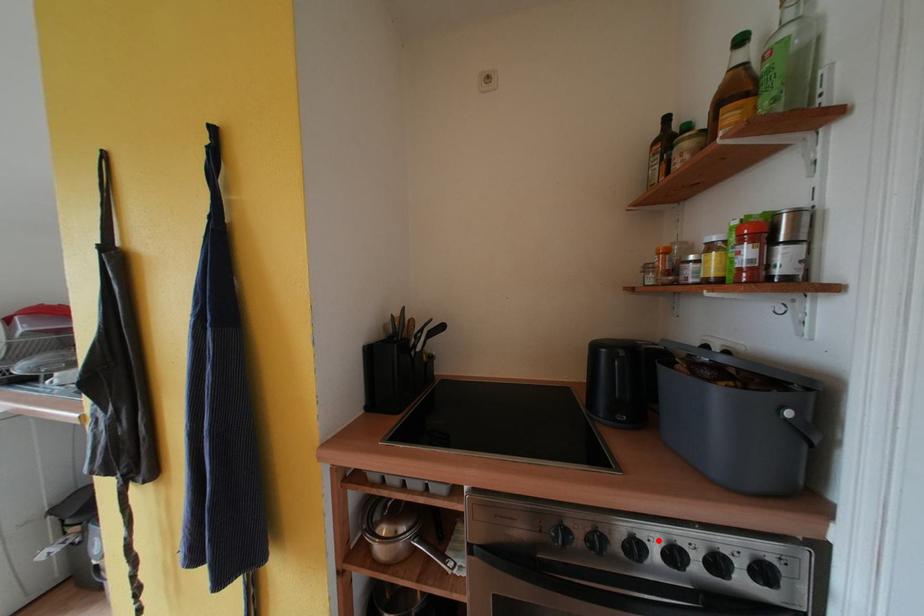
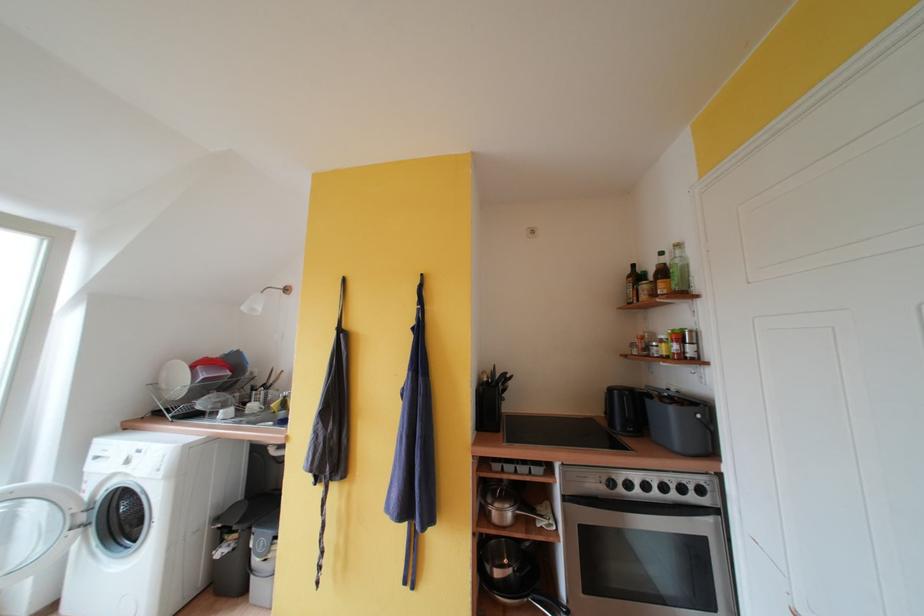
Question: I am providing you with two images of the same scene from different viewpoints. A red point is marked on the first image. Can you still see the location of the red point in image 2?

Choices:
 (A) Yes
 (B) No

Answer: (A)